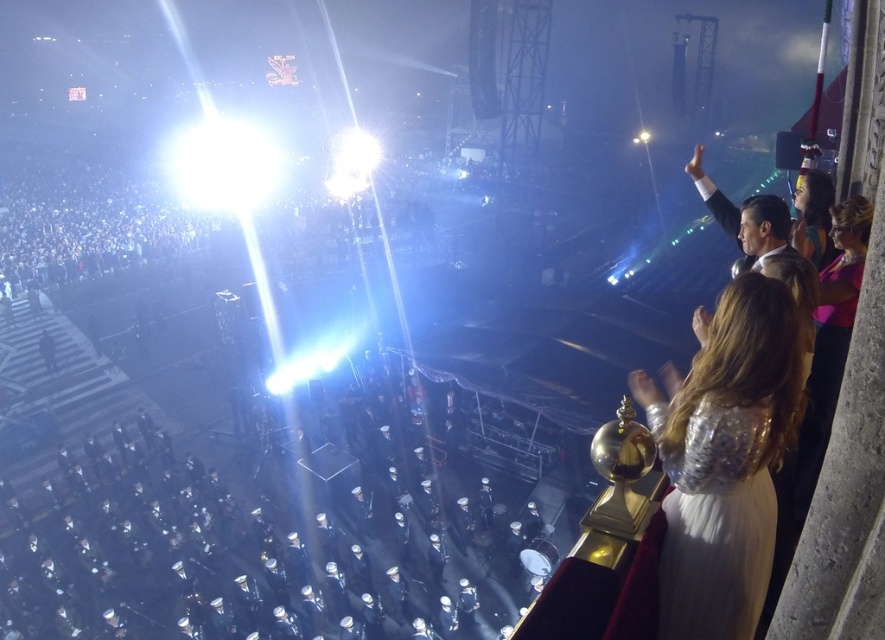
Question: Can you confirm if shiny silver dress at upper right is positioned above silver sequined dress at right?

Choices:
 (A) no
 (B) yes

Answer: (B)

Question: Which of the following is the closest to the observer?

Choices:
 (A) (739, 419)
 (B) (706, 609)

Answer: (A)

Question: Can you confirm if shiny silver dress at upper right is smaller than silver sequined dress at right?

Choices:
 (A) no
 (B) yes

Answer: (A)

Question: Is shiny silver dress at upper right wider than silver sequined dress at right?

Choices:
 (A) yes
 (B) no

Answer: (A)

Question: Which point appears closest to the camera in this image?

Choices:
 (A) (698, 438)
 (B) (763, 582)

Answer: (A)

Question: Which point is closer to the camera?

Choices:
 (A) silver sequined dress at right
 (B) shiny silver dress at upper right

Answer: (B)